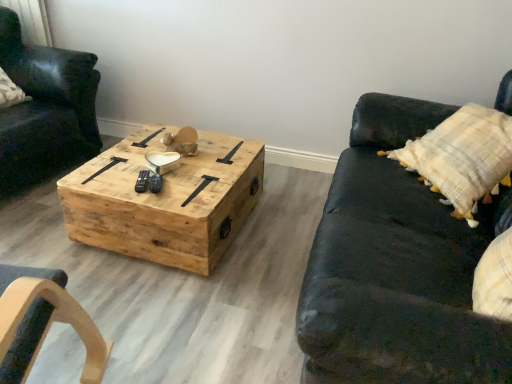
Measure the distance between point (81, 67) and camera.

Point (81, 67) is 2.41 meters away from camera.

I want to click on matte black leather chair at left, so click(x=45, y=110).

Considering the sizes of objects natural wood coffee table at center and matte black leather chair at left in the image provided, who is taller, natural wood coffee table at center or matte black leather chair at left?

matte black leather chair at left.

Looking at this image, between natural wood coffee table at center and matte black leather chair at left, which one is positioned in front?

natural wood coffee table at center.

What's the angular difference between natural wood coffee table at center and matte black leather chair at left's facing directions?

There is a 79.7-degree angle between the facing directions of natural wood coffee table at center and matte black leather chair at left.

Can we say natural wood coffee table at center lies outside matte black leather chair at left?

Indeed, natural wood coffee table at center is completely outside matte black leather chair at left.

Is matte black leather chair at left surrounding black leather couch at right?

No, black leather couch at right is not a part of matte black leather chair at left.

In the scene shown: Can you tell me how much matte black leather chair at left and black leather couch at right differ in facing direction?

167 degrees separate the facing orientations of matte black leather chair at left and black leather couch at right.

In the scene shown: Is matte black leather chair at left looking in the opposite direction of black leather couch at right?

No.

Is the surface of matte black leather chair at left in direct contact with black leather couch at right?

No, matte black leather chair at left is not in contact with black leather couch at right.

Is matte black leather chair at left far from natural wood coffee table at center?

No, there isn't a large distance between matte black leather chair at left and natural wood coffee table at center.

Is matte black leather chair at left taller than natural wood coffee table at center?

Yes, matte black leather chair at left is taller than natural wood coffee table at center.

Considering the positions of objects matte black leather chair at left and natural wood coffee table at center in the image provided, who is more to the left, matte black leather chair at left or natural wood coffee table at center?

matte black leather chair at left.

Can you confirm if matte black leather chair at left is thinner than natural wood coffee table at center?

No.

Based on the photo, is black leather couch at right facing towards natural wood coffee table at center?

Yes, black leather couch at right faces towards natural wood coffee table at center.

Considering the positions of points (469, 233) and (131, 197), is point (469, 233) closer to camera compared to point (131, 197)?

Yes, it is.

Is black leather couch at right positioned far away from natural wood coffee table at center?

black leather couch at right is near natural wood coffee table at center, not far away.

From a real-world perspective, is black leather couch at right below natural wood coffee table at center?

No, from a real-world perspective, black leather couch at right is not below natural wood coffee table at center.

Which is nearer, (354, 235) or (13, 194)?

Point (354, 235) appears to be closer to the viewer than point (13, 194).

Which of these two, black leather couch at right or matte black leather chair at left, stands shorter?

Standing shorter between the two is black leather couch at right.

Is black leather couch at right facing towards matte black leather chair at left?

Yes, black leather couch at right faces towards matte black leather chair at left.

Is black leather couch at right closer to camera compared to matte black leather chair at left?

Yes.

Would you say black leather couch at right is part of natural wood coffee table at center's contents?

No, black leather couch at right is located outside of natural wood coffee table at center.

In the scene shown: Between natural wood coffee table at center and black leather couch at right, which one has less height?

natural wood coffee table at center is shorter.

Between natural wood coffee table at center and black leather couch at right, which one appears on the right side from the viewer's perspective?

From the viewer's perspective, black leather couch at right appears more on the right side.

Locate an element on the screen. The height and width of the screenshot is (384, 512). studio couch below the natural wood coffee table at center (from the image's perspective) is located at coordinates (396, 268).

Find the location of a particular element. Image resolution: width=512 pixels, height=384 pixels. coffee table beneath the matte black leather chair at left (from a real-world perspective) is located at coordinates (164, 202).

At what (x,y) coordinates should I click in order to perform the action: click on studio couch in front of the matte black leather chair at left. Please return your answer as a coordinate pair (x, y). Looking at the image, I should click on (396, 268).

Looking at the image, which one is located closer to matte black leather chair at left, black leather couch at right or natural wood coffee table at center?

Based on the image, natural wood coffee table at center appears to be nearer to matte black leather chair at left.

Estimate the real-world distances between objects in this image. Which object is closer to natural wood coffee table at center, black leather couch at right or matte black leather chair at left?

The object closer to natural wood coffee table at center is black leather couch at right.

From the image, which object appears to be farther from matte black leather chair at left, natural wood coffee table at center or black leather couch at right?

black leather couch at right is further to matte black leather chair at left.

When comparing their distances from black leather couch at right, does matte black leather chair at left or natural wood coffee table at center seem further?

Based on the image, matte black leather chair at left appears to be further to black leather couch at right.

From the image, which object appears to be nearer to black leather couch at right, natural wood coffee table at center or matte black leather chair at left?

natural wood coffee table at center is closer to black leather couch at right.

Which object lies nearer to the anchor point natural wood coffee table at center, matte black leather chair at left or black leather couch at right?

Based on the image, black leather couch at right appears to be nearer to natural wood coffee table at center.

Locate an element on the screen. This screenshot has width=512, height=384. coffee table between matte black leather chair at left and black leather couch at right in the horizontal direction is located at coordinates (164, 202).